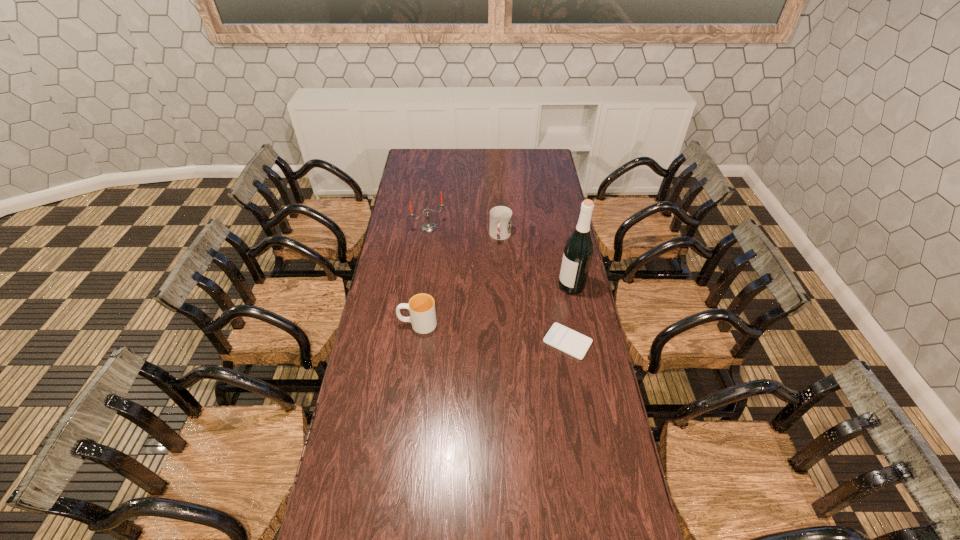
Where is `calculator at the right edge`? The width and height of the screenshot is (960, 540). calculator at the right edge is located at coordinates (560, 337).

Find the location of a particular element. wine bottle that is at the right edge is located at coordinates (578, 251).

In the image, there is a desktop. Find the location of `free space at the far edge`. free space at the far edge is located at coordinates (514, 148).

Image resolution: width=960 pixels, height=540 pixels. I want to click on vacant space at the near edge of the desktop, so click(x=429, y=495).

In the image, there is a desktop. Identify the location of vacant space at the left edge. (399, 191).

This screenshot has height=540, width=960. Identify the location of vacant space at the right edge of the desktop. (559, 269).

At what (x,y) coordinates should I click in order to perform the action: click on vacant area between the nearer cup and the calculator. Please return your answer as a coordinate pair (x, y). The image size is (960, 540). Looking at the image, I should click on (492, 333).

Where is `empty location between the shortest object and the wine bottle`? empty location between the shortest object and the wine bottle is located at coordinates (569, 314).

Find the location of a particular element. vacant area between the calculator and the third object from left to right is located at coordinates (534, 289).

Locate an element on the screen. The height and width of the screenshot is (540, 960). empty space that is in between the tallest object and the shortest object is located at coordinates (569, 314).